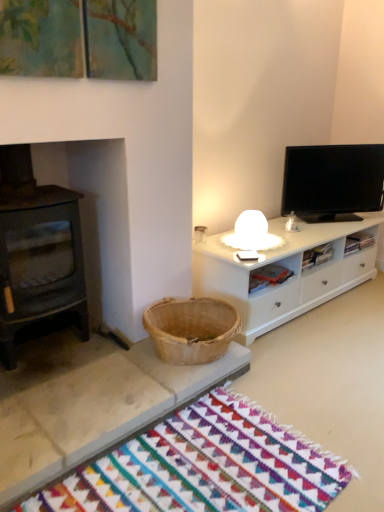
Question: From a real-world perspective, does multicolored woven mat at lower center stand above black glossy tv at upper right?

Choices:
 (A) yes
 (B) no

Answer: (B)

Question: From a real-world perspective, is multicolored woven mat at lower center physically below black glossy tv at upper right?

Choices:
 (A) no
 (B) yes

Answer: (B)

Question: From the image's perspective, is multicolored woven mat at lower center located above black glossy tv at upper right?

Choices:
 (A) yes
 (B) no

Answer: (B)

Question: Is multicolored woven mat at lower center not inside black glossy tv at upper right?

Choices:
 (A) no
 (B) yes

Answer: (B)

Question: Is multicolored woven mat at lower center in front of black glossy tv at upper right?

Choices:
 (A) no
 (B) yes

Answer: (B)

Question: From the image's perspective, would you say multicolored woven mat at lower center is shown under black glossy tv at upper right?

Choices:
 (A) yes
 (B) no

Answer: (A)

Question: Is black glossy tv at upper right at the left side of multicolored woven mat at lower center?

Choices:
 (A) yes
 (B) no

Answer: (B)

Question: From the image's perspective, is black glossy tv at upper right on top of multicolored woven mat at lower center?

Choices:
 (A) yes
 (B) no

Answer: (A)

Question: Is black glossy tv at upper right turned away from multicolored woven mat at lower center?

Choices:
 (A) yes
 (B) no

Answer: (B)

Question: Could you tell me if black glossy tv at upper right is turned towards multicolored woven mat at lower center?

Choices:
 (A) yes
 (B) no

Answer: (B)

Question: Is black glossy tv at upper right in contact with multicolored woven mat at lower center?

Choices:
 (A) no
 (B) yes

Answer: (A)

Question: Does black glossy tv at upper right have a larger size compared to multicolored woven mat at lower center?

Choices:
 (A) no
 (B) yes

Answer: (B)

Question: From the image's perspective, is multicolored woven mat at lower center above or below black glossy tv at upper right?

Choices:
 (A) above
 (B) below

Answer: (B)